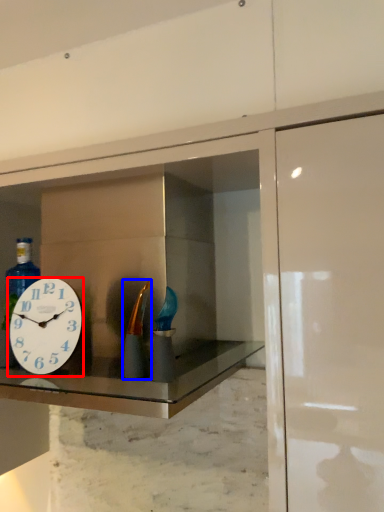
Question: Which object is further to the camera taking this photo, wall clock (highlighted by a red box) or bottle (highlighted by a blue box)?

Choices:
 (A) wall clock
 (B) bottle

Answer: (A)